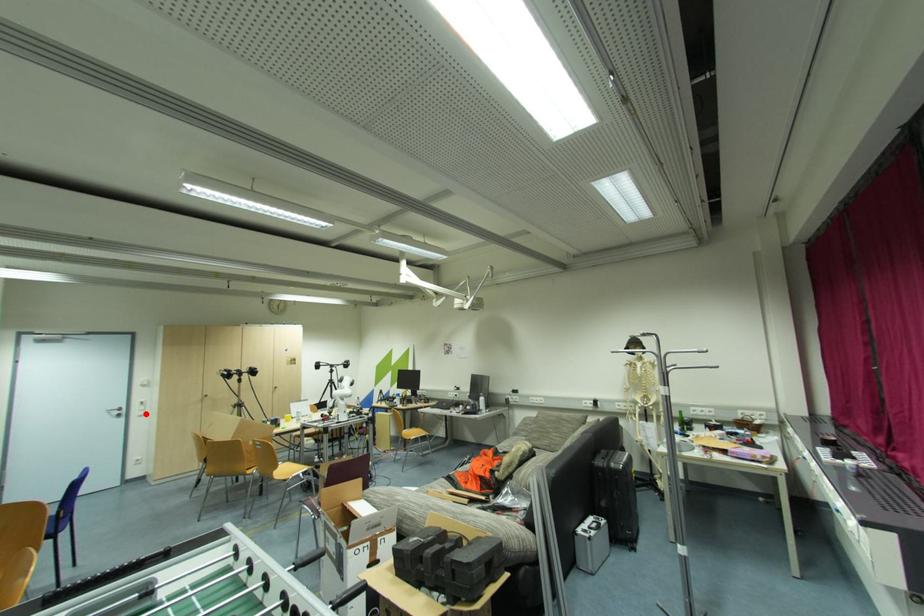
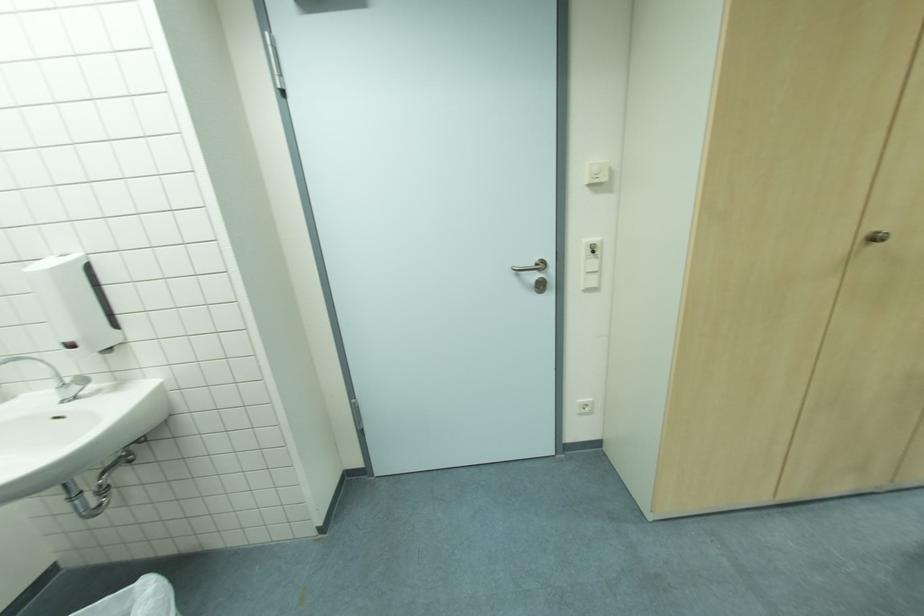
Where in the second image is the point corresponding to the highlighted location from the first image?

(598, 285)